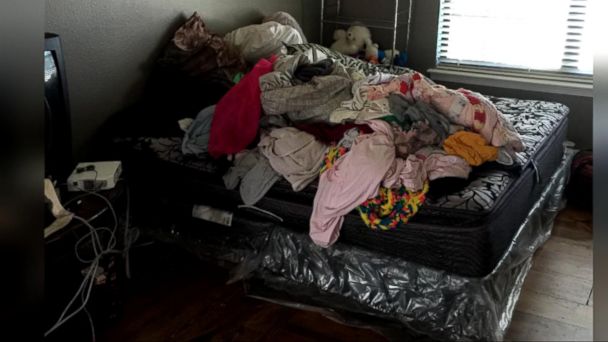
Where is `box tv`? box tv is located at coordinates (59, 80).